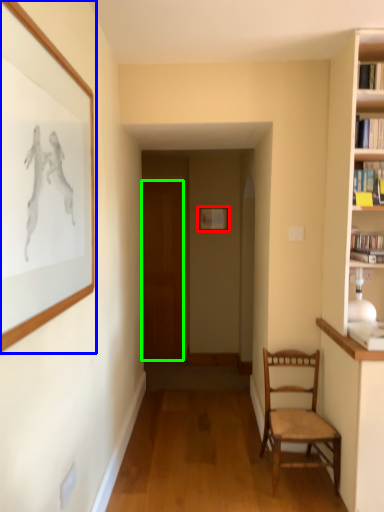
Question: Considering the real-world distances, which object is farthest from picture frame (highlighted by a red box)? picture frame (highlighted by a blue box) or door (highlighted by a green box)?

Choices:
 (A) picture frame
 (B) door

Answer: (A)